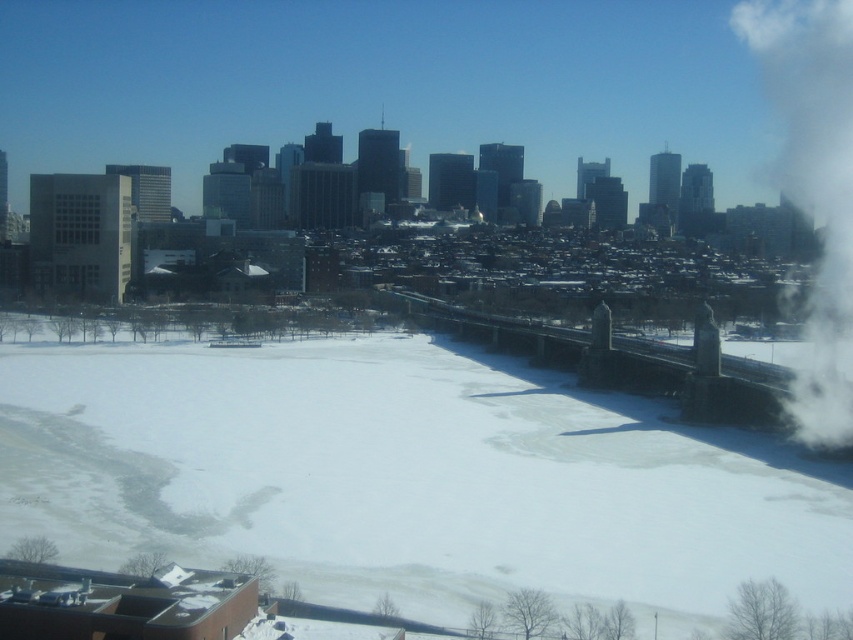
Question: Can you confirm if white powdery snow at center is thinner than white smoke at upper right?

Choices:
 (A) no
 (B) yes

Answer: (A)

Question: Does white powdery snow at center have a smaller size compared to white smoke at upper right?

Choices:
 (A) yes
 (B) no

Answer: (A)

Question: Which of the following is the closest to the observer?

Choices:
 (A) (817, 166)
 (B) (846, 602)

Answer: (B)

Question: Is white powdery snow at center bigger than white smoke at upper right?

Choices:
 (A) yes
 (B) no

Answer: (B)

Question: Which of the following is the closest to the observer?

Choices:
 (A) white powdery snow at center
 (B) white smoke at upper right

Answer: (A)